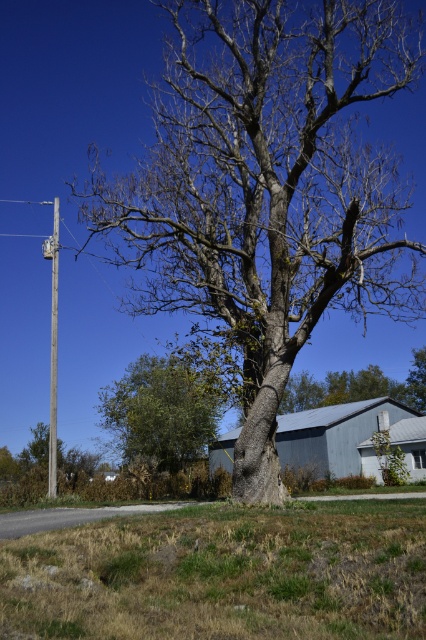
Question: Can you confirm if green leafy bush at lower left is positioned to the right of wooden pole at left?

Choices:
 (A) no
 (B) yes

Answer: (B)

Question: Which object appears farthest from the camera in this image?

Choices:
 (A) green leafy bush at lower left
 (B) smooth gray bark oak tree at center
 (C) wooden pole at left

Answer: (C)

Question: Does green leafy bush at lower left appear on the right side of wooden pole at left?

Choices:
 (A) yes
 (B) no

Answer: (A)

Question: Which point appears closest to the camera in this image?

Choices:
 (A) (169, 468)
 (B) (256, 64)

Answer: (B)

Question: Is smooth gray bark oak tree at center thinner than green leafy bush at lower left?

Choices:
 (A) yes
 (B) no

Answer: (B)

Question: Which of the following is the closest to the observer?

Choices:
 (A) (103, 406)
 (B) (420, 52)

Answer: (B)